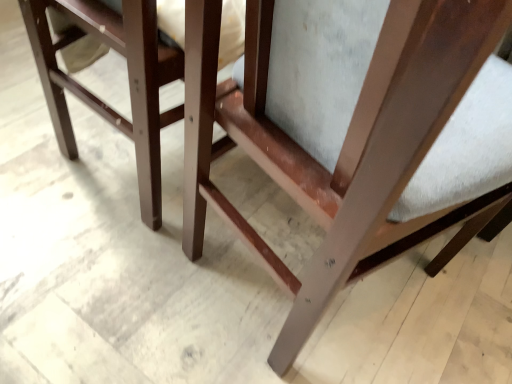
Question: Does matte wood chair at center have a greater height compared to matte wood chair at center?

Choices:
 (A) yes
 (B) no

Answer: (A)

Question: Does matte wood chair at center come in front of matte wood chair at center?

Choices:
 (A) yes
 (B) no

Answer: (A)

Question: Are matte wood chair at center and matte wood chair at center far apart?

Choices:
 (A) yes
 (B) no

Answer: (B)

Question: Is matte wood chair at center positioned behind matte wood chair at center?

Choices:
 (A) no
 (B) yes

Answer: (A)

Question: Does matte wood chair at center have a smaller size compared to matte wood chair at center?

Choices:
 (A) yes
 (B) no

Answer: (B)

Question: Can you confirm if matte wood chair at center is positioned to the right of matte wood chair at center?

Choices:
 (A) yes
 (B) no

Answer: (A)

Question: Does matte wood chair at center appear on the left side of matte wood chair at center?

Choices:
 (A) no
 (B) yes

Answer: (B)

Question: From a real-world perspective, is matte wood chair at center on matte wood chair at center?

Choices:
 (A) yes
 (B) no

Answer: (B)

Question: Is matte wood chair at center at the right side of matte wood chair at center?

Choices:
 (A) no
 (B) yes

Answer: (A)

Question: Does matte wood chair at center contain matte wood chair at center?

Choices:
 (A) yes
 (B) no

Answer: (B)

Question: Can you confirm if matte wood chair at center is bigger than matte wood chair at center?

Choices:
 (A) yes
 (B) no

Answer: (B)

Question: Does matte wood chair at center lie in front of matte wood chair at center?

Choices:
 (A) yes
 (B) no

Answer: (B)

Question: From a real-world perspective, is matte wood chair at center physically located above or below matte wood chair at center?

Choices:
 (A) below
 (B) above

Answer: (B)